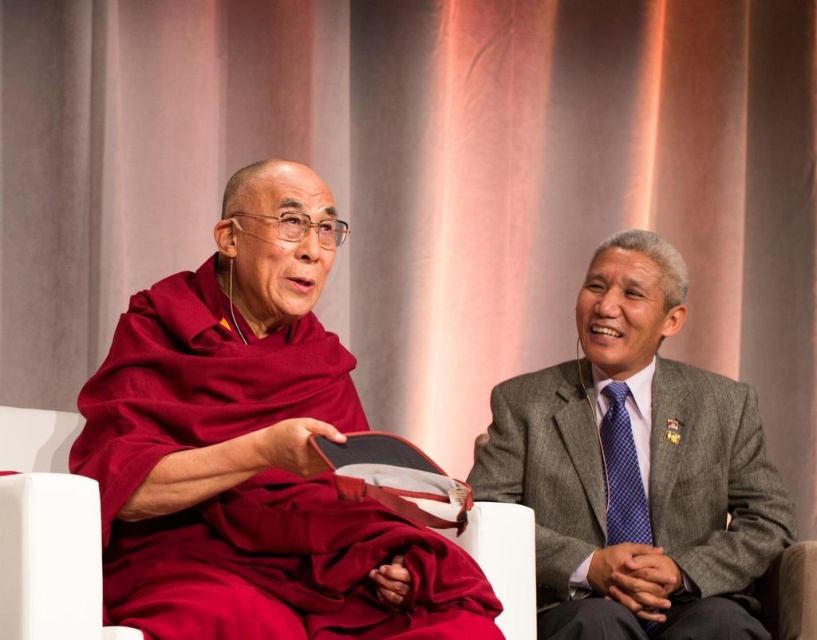
Question: Does silky maroon robe at left appear under gray wool suit at right?

Choices:
 (A) no
 (B) yes

Answer: (A)

Question: Where is silky maroon robe at left located in relation to gray wool suit at right in the image?

Choices:
 (A) below
 (B) above

Answer: (B)

Question: Is silky maroon robe at left bigger than gray wool suit at right?

Choices:
 (A) no
 (B) yes

Answer: (A)

Question: Which object appears closest to the camera in this image?

Choices:
 (A) silky maroon robe at left
 (B) gray wool suit at right

Answer: (A)

Question: Which point is closer to the camera?

Choices:
 (A) (663, 429)
 (B) (297, 406)

Answer: (B)

Question: Which point is farther to the camera?

Choices:
 (A) (588, 554)
 (B) (255, 298)

Answer: (A)